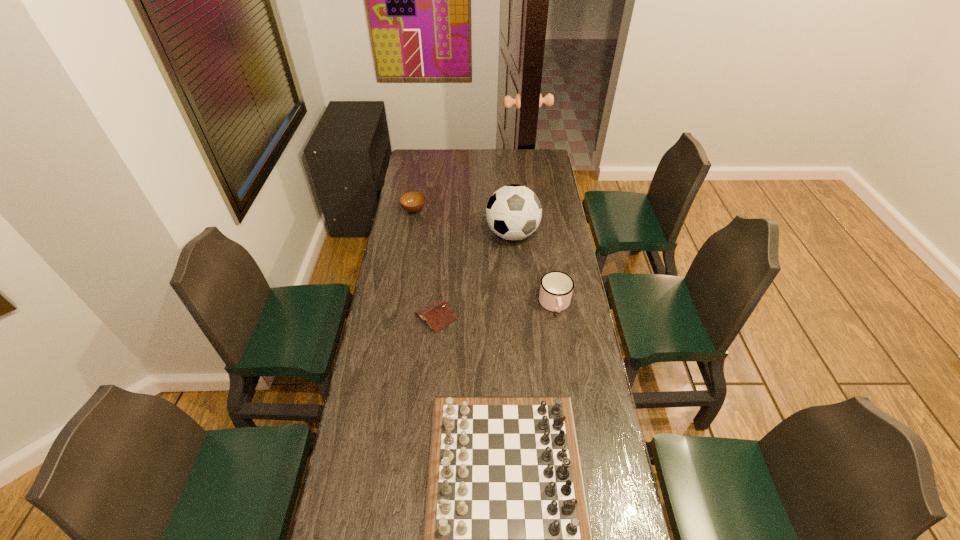
This screenshot has height=540, width=960. In order to click on empty space between the book and the soccer ball in this screenshot , I will do `click(474, 275)`.

Identify the location of free area in between the book and the soccer ball. This screenshot has height=540, width=960. (474, 275).

Select which object appears as the third closest to the tallest object. Please provide its 2D coordinates. Your answer should be formatted as a tuple, i.e. [(x, y)], where the tuple contains the x and y coordinates of a point satisfying the conditions above.

[(438, 314)]

Identify which object is the nearest to the nearest object. Please provide its 2D coordinates. Your answer should be formatted as a tuple, i.e. [(x, y)], where the tuple contains the x and y coordinates of a point satisfying the conditions above.

[(438, 314)]